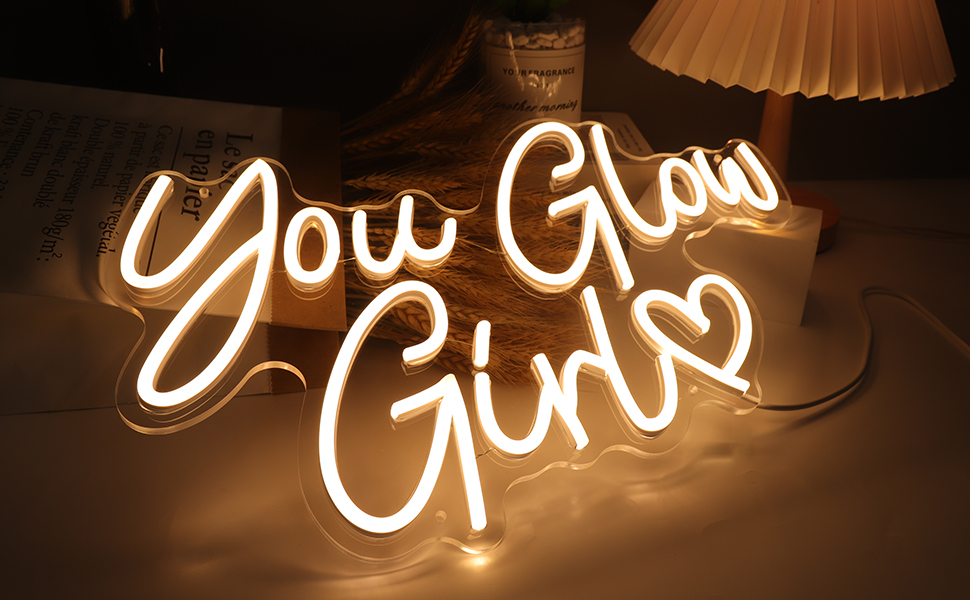
At what (x,y) coordinates should I click in order to perform the action: click on led sign cable cord. Please return your answer as a coordinate pair (x, y). Looking at the image, I should click on pos(844,385).